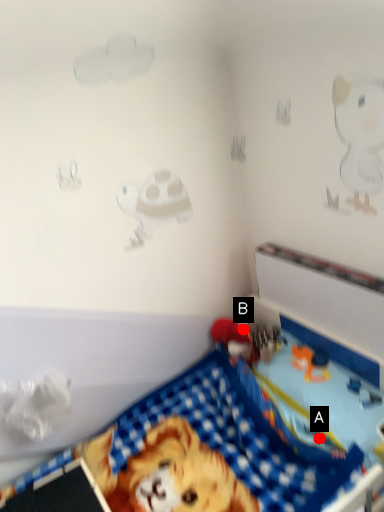
Question: Two points are circled on the image, labeled by A and B beside each circle. Which point is closer to the camera taking this photo?

Choices:
 (A) A is closer
 (B) B is closer

Answer: (A)